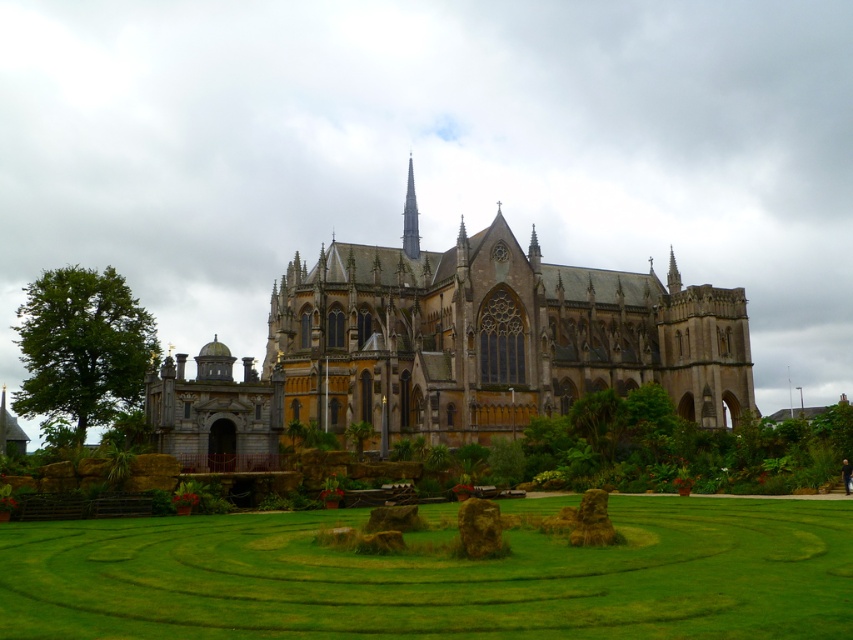
Is green grass maze at center wider than yellow stone church at center?

No, green grass maze at center is not wider than yellow stone church at center.

Does green grass maze at center appear over yellow stone church at center?

No, green grass maze at center is not above yellow stone church at center.

The height and width of the screenshot is (640, 853). Find the location of `green grass maze at center`. green grass maze at center is located at coordinates (437, 577).

Image resolution: width=853 pixels, height=640 pixels. Identify the location of green grass maze at center. (437, 577).